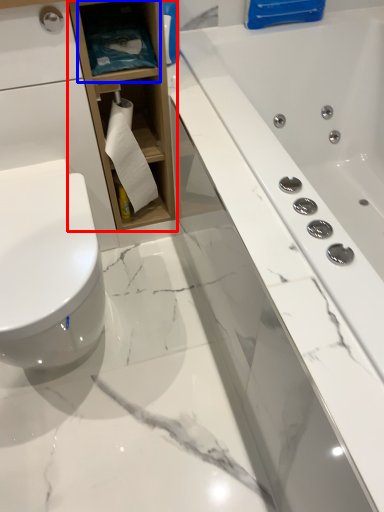
Question: Which of the following is the farthest to the observer, bathroom cabinet (highlighted by a red box) or shelf (highlighted by a blue box)?

Choices:
 (A) bathroom cabinet
 (B) shelf

Answer: (B)